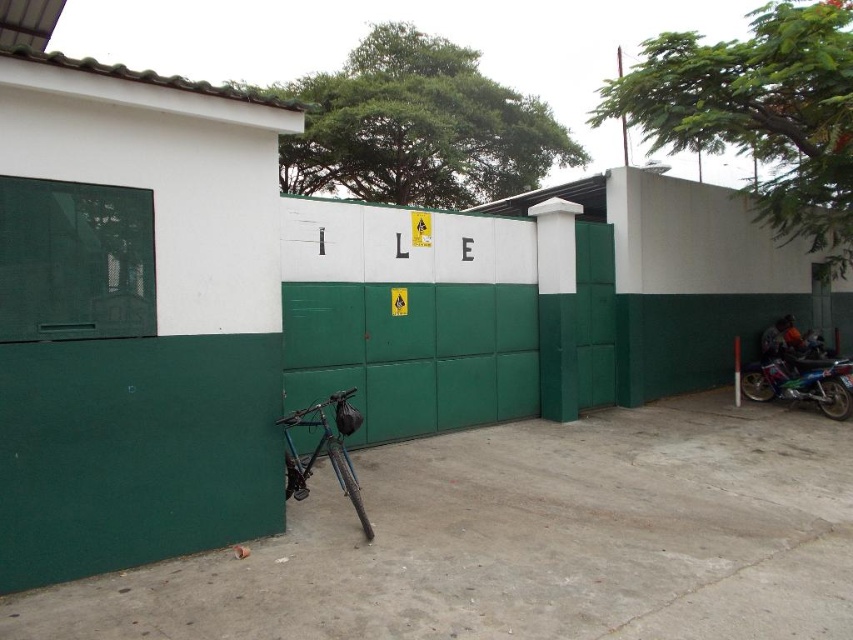
You are a delivery person who needs to park your vehicle between the shiny metallic bicycle at center and the blue metallic motorcycle at right. Can you fit your 1.2 meter wide delivery van between them?

The shiny metallic bicycle at center is located below the blue metallic motorcycle at right, but their horizontal distance isn not specified. Without knowing the horizontal space between them, it is impossible to determine if the van can fit.

You are standing at the origin point of the image coordinate system where the bottom left corner is the origin. The image coordinate system has the x axis going from left to right and the y axis going from bottom to top. You want to place a new sign at coordinate point 0.5, 0.5. Is the shiny metallic bicycle at center blocking the placement of the new sign at coordinate point 0.5, 0.5?

The shiny metallic bicycle at center is located at coordinate point (325, 451), which is to the right and below the desired placement point of (426, 320). Therefore, the shiny metallic bicycle at center is not blocking the placement of the new sign at coordinate point (426, 320).

You are a delivery person trying to park your vehicle between two poles that are 1.5 meters apart. You have a shiny metallic bicycle at center and a blue metallic motorcycle at right. Which vehicle can fit through the space between the poles?

The shiny metallic bicycle at center has a lesser width compared to blue metallic motorcycle at right, so the bicycle can fit through the 1.5 meter space between the poles while the motorcycle may be too wide.